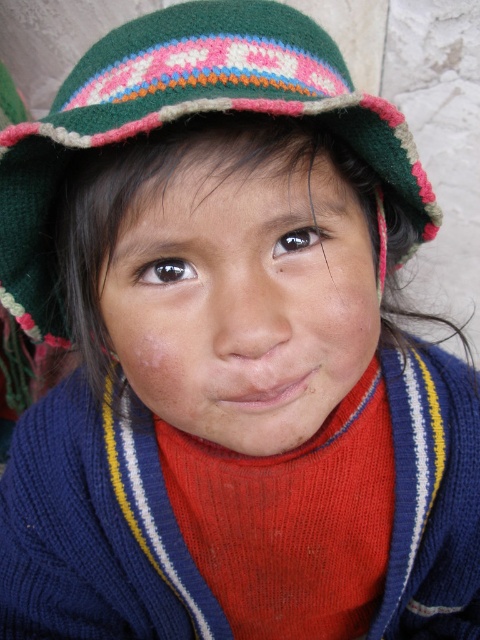
Question: Which of the following is the farthest from the observer?

Choices:
 (A) smooth skin face at center
 (B) green knitted hat at upper center

Answer: (A)

Question: Is smooth skin face at center below green knitted hat at upper center?

Choices:
 (A) yes
 (B) no

Answer: (A)

Question: Is smooth skin face at center to the right of green knitted hat at upper center from the viewer's perspective?

Choices:
 (A) yes
 (B) no

Answer: (A)

Question: Which of the following is the farthest from the observer?

Choices:
 (A) green knitted hat at upper center
 (B) smooth skin face at center

Answer: (B)

Question: In this image, where is smooth skin face at center located relative to green knitted hat at upper center?

Choices:
 (A) right
 (B) left

Answer: (A)